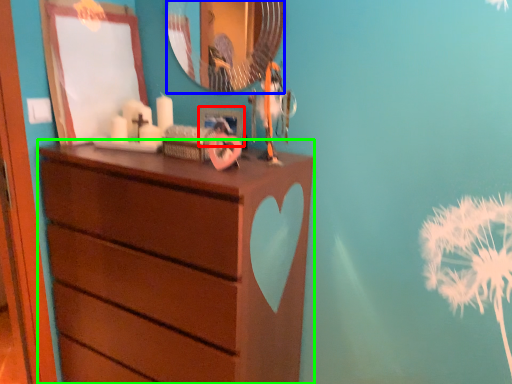
Question: Considering the real-world distances, which object is farthest from picture frame (highlighted by a red box)? mirror (highlighted by a blue box) or chest of drawers (highlighted by a green box)?

Choices:
 (A) mirror
 (B) chest of drawers

Answer: (B)